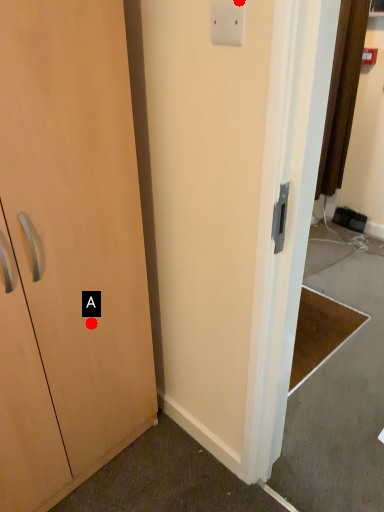
Question: Two points are circled on the image, labeled by A and B beside each circle. Which of the following is the farthest from the observer?

Choices:
 (A) A is further
 (B) B is further

Answer: (A)